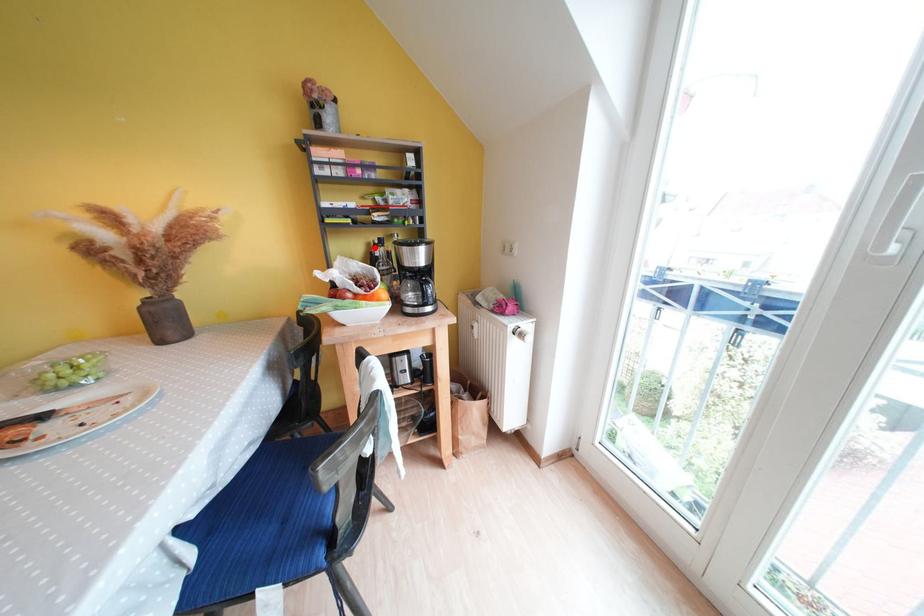
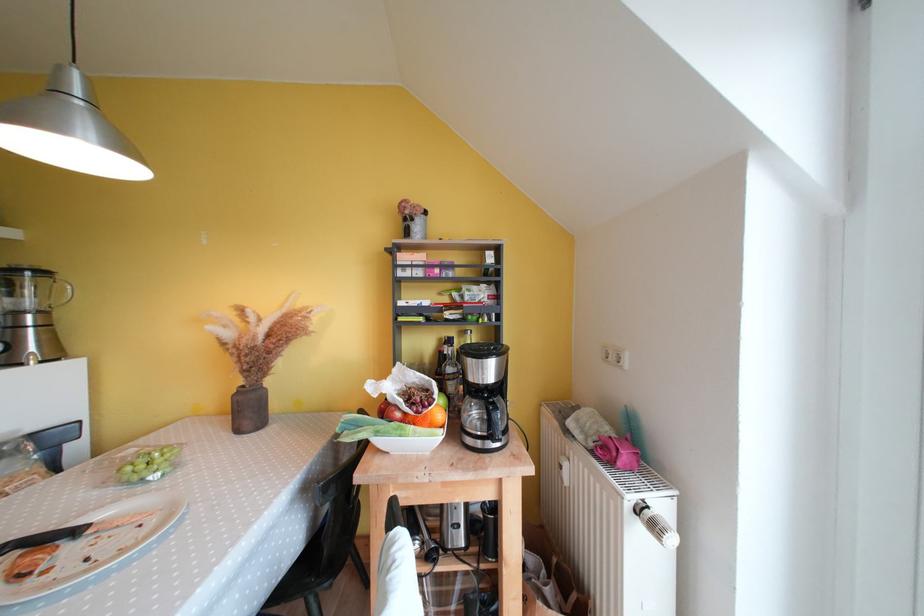
Question: I am providing you with two images of the same scene from different viewpoints. Image1 has a red point marked. In image2, the corresponding 3D location appears at what relative position? Reply with the corresponding letter.

Choices:
 (A) Closer
 (B) Farther

Answer: (B)